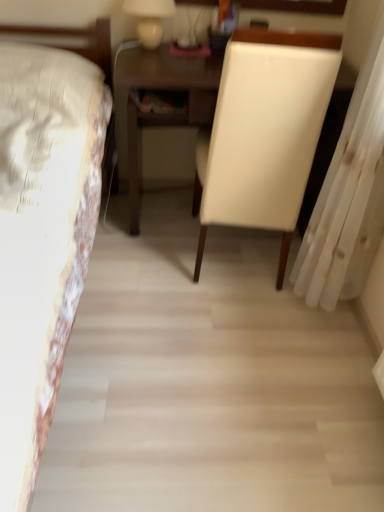
Where is `blank area beneath white leather chair at center (from a real-world perspective)`? Image resolution: width=384 pixels, height=512 pixels. blank area beneath white leather chair at center (from a real-world perspective) is located at coordinates (239, 265).